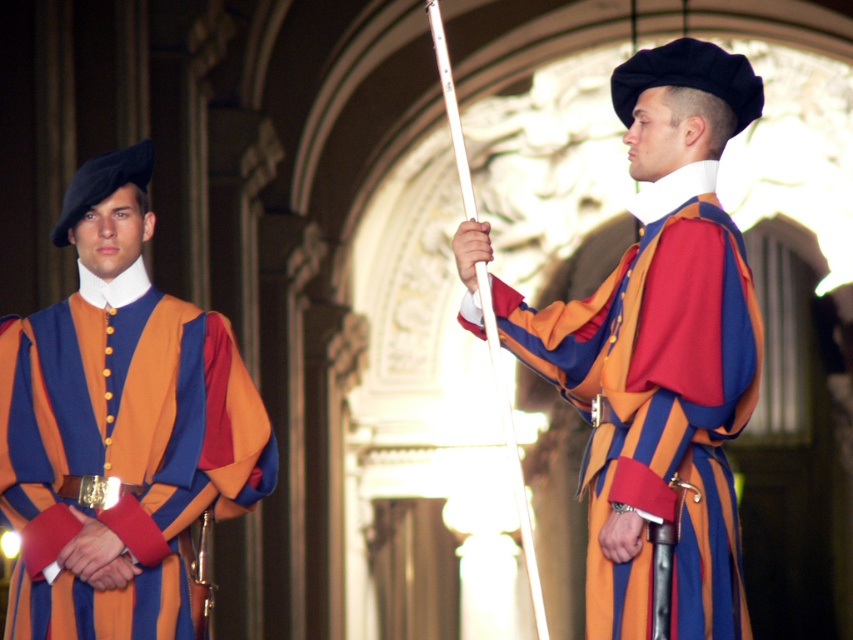
Question: Is matte orange and blue striped tunic at center above matte orange vest at center?

Choices:
 (A) yes
 (B) no

Answer: (A)

Question: Which object appears closest to the camera in this image?

Choices:
 (A) matte orange and blue striped tunic at center
 (B) matte orange vest at center

Answer: (A)

Question: Does matte orange and blue striped tunic at center appear over matte orange vest at center?

Choices:
 (A) yes
 (B) no

Answer: (A)

Question: Which point appears farthest from the camera in this image?

Choices:
 (A) (578, 300)
 (B) (215, 492)

Answer: (A)

Question: Where is matte orange and blue striped tunic at center located in relation to matte orange vest at center in the image?

Choices:
 (A) above
 (B) below

Answer: (A)